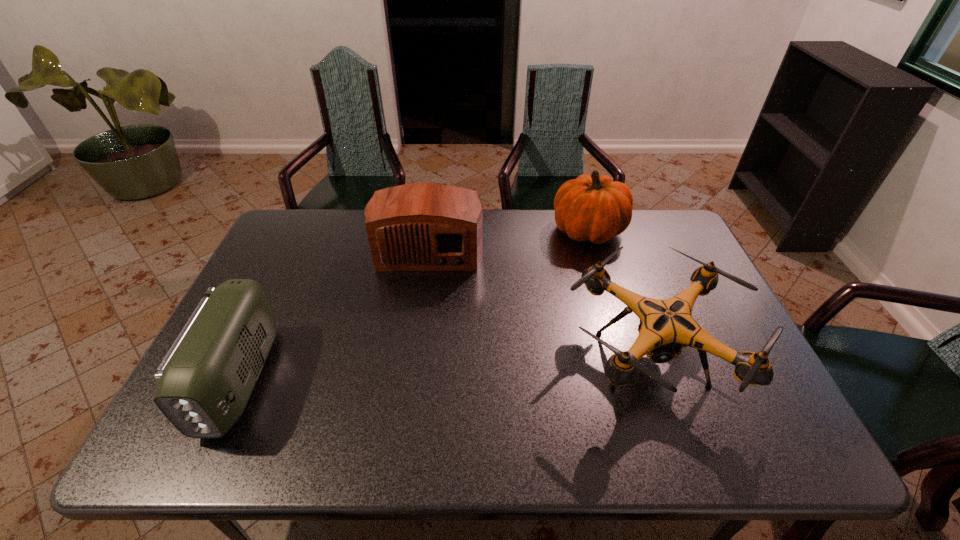
In order to click on object that is the third closest to the drone in this screenshot , I will do `click(204, 382)`.